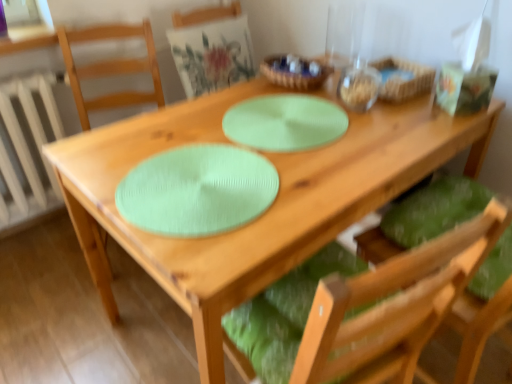
Find the location of a particular element. Image resolution: width=512 pixels, height=384 pixels. free space to the back side of mint green textured placemat at center is located at coordinates (229, 122).